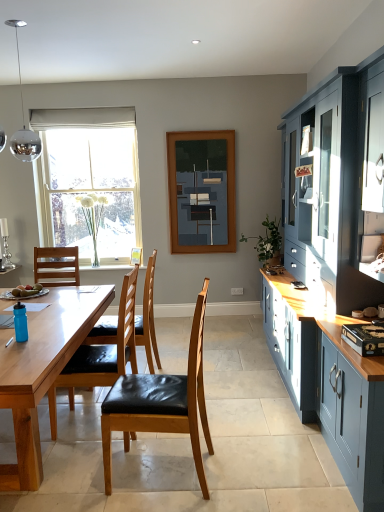
Question: Can you confirm if green leafy plant at right is positioned to the right of blue plastic power plugs and sockets at lower left?

Choices:
 (A) no
 (B) yes

Answer: (B)

Question: Can you confirm if green leafy plant at right is smaller than blue plastic power plugs and sockets at lower left?

Choices:
 (A) yes
 (B) no

Answer: (B)

Question: Is green leafy plant at right far from blue plastic power plugs and sockets at lower left?

Choices:
 (A) no
 (B) yes

Answer: (B)

Question: Is green leafy plant at right facing towards blue plastic power plugs and sockets at lower left?

Choices:
 (A) no
 (B) yes

Answer: (A)

Question: Is green leafy plant at right to the left of blue plastic power plugs and sockets at lower left from the viewer's perspective?

Choices:
 (A) no
 (B) yes

Answer: (A)

Question: Is green leafy plant at right thinner than blue plastic power plugs and sockets at lower left?

Choices:
 (A) no
 (B) yes

Answer: (A)

Question: Is wooden chair with black leather seat at left, the 2th chair viewed from the front, beside white fabric curtain at upper center?

Choices:
 (A) yes
 (B) no

Answer: (B)

Question: Does wooden chair with black leather seat at left, the 2th chair viewed from the front, have a greater width compared to white fabric curtain at upper center?

Choices:
 (A) yes
 (B) no

Answer: (A)

Question: Is wooden chair with black leather seat at left, which is the 2th chair in back-to-front order, oriented away from white fabric curtain at upper center?

Choices:
 (A) no
 (B) yes

Answer: (A)

Question: Is white fabric curtain at upper center inside wooden chair with black leather seat at left, which is the 2th chair in back-to-front order?

Choices:
 (A) no
 (B) yes

Answer: (A)

Question: Is wooden chair with black leather seat at left, the 2th chair viewed from the front, facing towards white fabric curtain at upper center?

Choices:
 (A) yes
 (B) no

Answer: (B)

Question: Considering the relative sizes of wooden chair with black leather seat at left, the 2th chair viewed from the front, and white fabric curtain at upper center in the image provided, is wooden chair with black leather seat at left, the 2th chair viewed from the front, smaller than white fabric curtain at upper center?

Choices:
 (A) no
 (B) yes

Answer: (A)

Question: From a real-world perspective, is polished chrome globe at upper left under blue plastic power plugs and sockets at lower left?

Choices:
 (A) no
 (B) yes

Answer: (A)